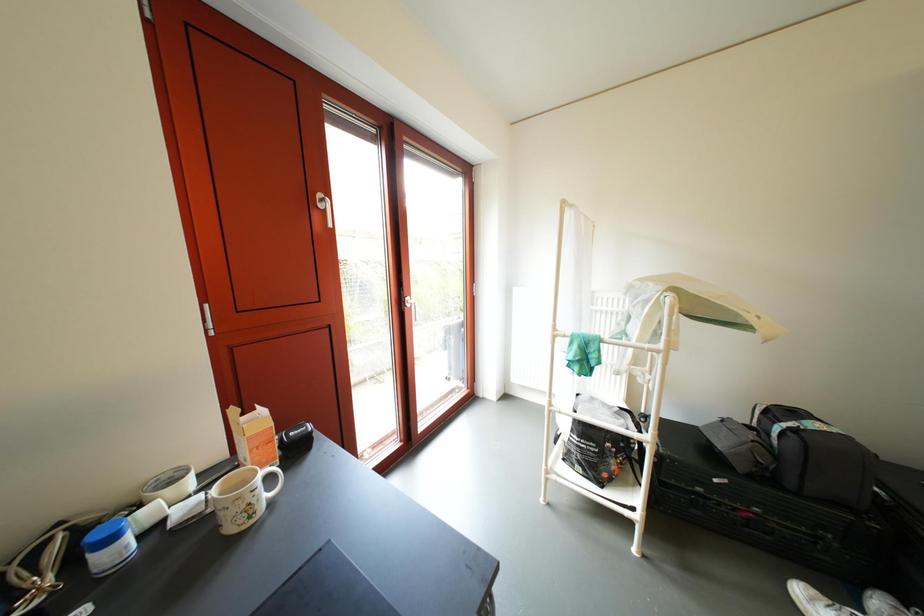
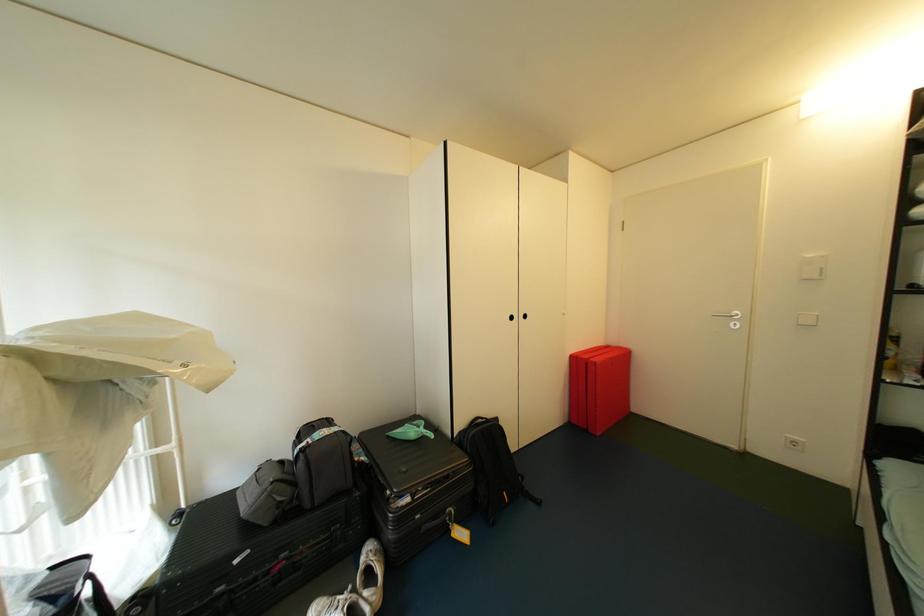
Question: The camera is either moving clockwise (left) or counter-clockwise (right) around the object. The first image is from the beginning of the video and the second image is from the end. Is the camera moving left or right when shooting the video?

Choices:
 (A) Left
 (B) Right

Answer: (A)